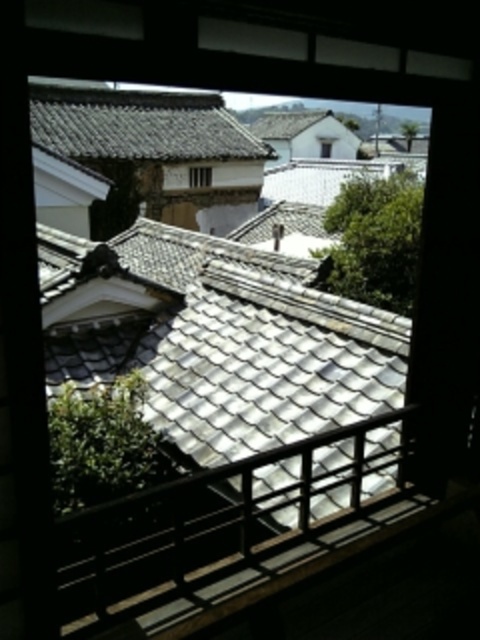
Can you confirm if clear glass window at center is wider than transparent glass window at center?

In fact, clear glass window at center might be narrower than transparent glass window at center.

Does point (211, 182) lie in front of point (328, 152)?

That is True.

Where is `clear glass window at center`? The height and width of the screenshot is (640, 480). clear glass window at center is located at coordinates (200, 177).

Identify the location of clear glass window at center. Image resolution: width=480 pixels, height=640 pixels. (200, 177).

Can you confirm if gray tile roof at upper center is positioned to the right of transparent glass window at center?

In fact, gray tile roof at upper center is to the left of transparent glass window at center.

Is point (110, 145) more distant than point (331, 150)?

No, (110, 145) is closer to viewer.

Where is `gray tile roof at upper center`? Image resolution: width=480 pixels, height=640 pixels. gray tile roof at upper center is located at coordinates (139, 124).

The height and width of the screenshot is (640, 480). Find the location of `white glazed tiles at center`. white glazed tiles at center is located at coordinates (216, 337).

Is white glazed tiles at center taller than clear glass window at center?

Indeed, white glazed tiles at center has a greater height compared to clear glass window at center.

Measure the distance between point (357, 339) and camera.

A distance of 29.08 feet exists between point (357, 339) and camera.

Where is `white glazed tiles at center`? white glazed tiles at center is located at coordinates (216, 337).